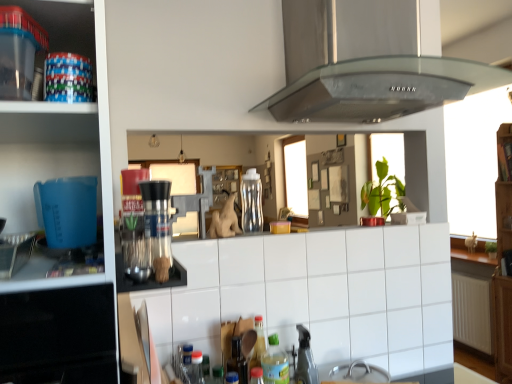
In order to face stainless steel range hood at upper center, should I rotate leftwards or rightwards?

To align with it, rotate right about 15.966°.

Describe the element at coordinates (362, 76) in the screenshot. I see `stainless steel range hood at upper center` at that location.

Describe the element at coordinates (305, 359) in the screenshot. I see `metallic silver faucet at lower center` at that location.

Find the location of a particular element. satin silver coffee machine at center is located at coordinates (157, 225).

Describe the element at coordinates (317, 294) in the screenshot. I see `white tile at center` at that location.

This screenshot has height=384, width=512. I want to click on translucent plastic bottle at lower center, acting as the second bottle starting from the top, so click(275, 363).

Is metallic silver faucet at lower center placed right next to transparent plastic containers at upper left?

No.

From a real-world perspective, is metallic silver faucet at lower center on top of transparent plastic containers at upper left?

Actually, metallic silver faucet at lower center is physically below transparent plastic containers at upper left in the real world.

You are a GUI agent. You are given a task and a screenshot of the screen. Output one action in this format:
    pyautogui.click(x=<x>, y=<y>)
    Task: Click on the cabinetry above the metallic silver faucet at lower center (from the image's perspective)
    The height and width of the screenshot is (384, 512).
    Given the screenshot: What is the action you would take?
    (65, 25)

Is metallic silver faucet at lower center not within transparent plastic containers at upper left?

metallic silver faucet at lower center lies outside transparent plastic containers at upper left's area.

Do you think white tile at center is within translucent plastic bottle at lower center, placed as the first bottle when sorted from bottom to top, or outside of it?

white tile at center is located beyond the bounds of translucent plastic bottle at lower center, placed as the first bottle when sorted from bottom to top.

Considering the relative positions of white tile at center and translucent plastic bottle at lower center, which is the 1th bottle from front to back, in the image provided, is white tile at center to the left of translucent plastic bottle at lower center, which is the 1th bottle from front to back, from the viewer's perspective?

No.

Based on their sizes in the image, would you say transparent plastic containers at upper left is bigger or smaller than wooden shelf at upper right?

Considering their sizes, transparent plastic containers at upper left takes up more space than wooden shelf at upper right.

How many degrees apart are the facing directions of transparent plastic containers at upper left and wooden shelf at upper right?

90.4 degrees separate the facing orientations of transparent plastic containers at upper left and wooden shelf at upper right.

From the image's perspective, is transparent plastic containers at upper left located above or below wooden shelf at upper right?

transparent plastic containers at upper left is situated lower than wooden shelf at upper right in the image.

Which object is positioned more to the left, transparent plastic containers at upper left or wooden shelf at upper right?

transparent plastic containers at upper left is more to the left.

Which object is positioned more to the right, satin silver coffee machine at center or wooden shelf at upper right?

From the viewer's perspective, wooden shelf at upper right appears more on the right side.

Considering the positions of objects satin silver coffee machine at center and wooden shelf at upper right in the image provided, who is behind, satin silver coffee machine at center or wooden shelf at upper right?

wooden shelf at upper right is more distant.

From a real-world perspective, between satin silver coffee machine at center and wooden shelf at upper right, who is vertically higher?

wooden shelf at upper right is physically above.

Consider the image. Does wooden shelf at upper right appear on the right side of white tile at center?

Yes, wooden shelf at upper right is to the right of white tile at center.

In the scene shown: From the image's perspective, is wooden shelf at upper right above or below white tile at center?

From the image's perspective, wooden shelf at upper right appears above white tile at center.

Is wooden shelf at upper right closer to camera compared to white tile at center?

No, wooden shelf at upper right is further to the viewer.

Is wooden shelf at upper right oriented towards white tile at center?

No, wooden shelf at upper right does not turn towards white tile at center.

Which is more to the left, stainless steel range hood at upper center or translucent plastic bottle at lower center, the 2th bottle positioned from the back?

Positioned to the left is translucent plastic bottle at lower center, the 2th bottle positioned from the back.

Is point (306, 121) behind point (269, 342)?

Yes, point (306, 121) is behind point (269, 342).

From a real-world perspective, between stainless steel range hood at upper center and translucent plastic bottle at lower center, acting as the second bottle starting from the top, who is vertically lower?

translucent plastic bottle at lower center, acting as the second bottle starting from the top, from a real-world perspective.

From the image's perspective, which is above, stainless steel range hood at upper center or translucent plastic bottle at lower center, placed as the first bottle when sorted from bottom to top?

stainless steel range hood at upper center.

Is the position of transparent plastic bottle at center, which is counted as the 1th bottle, starting from the back, more distant than that of stainless steel range hood at upper center?

Yes, it is.

How different are the orientations of transparent plastic bottle at center, which is counted as the 1th bottle, starting from the back, and stainless steel range hood at upper center in degrees?

The angular difference between transparent plastic bottle at center, which is counted as the 1th bottle, starting from the back, and stainless steel range hood at upper center is 1.02 degrees.

Is transparent plastic bottle at center, which is counted as the 1th bottle, starting from the back, placed right next to stainless steel range hood at upper center?

transparent plastic bottle at center, which is counted as the 1th bottle, starting from the back, and stainless steel range hood at upper center are not in contact.

Is point (259, 197) in front of point (368, 74)?

That is False.

Identify the location of cabinetry that appears on the left of metallic silver faucet at lower center. [65, 25].

I want to click on counter top above the translucent plastic bottle at lower center, acting as the second bottle starting from the top (from a real-world perspective), so click(x=317, y=294).

Considering their positions, is transparent plastic containers at upper left positioned closer to transparent plastic bottle at center, marked as the 1th bottle in a top-to-bottom arrangement, than wooden shelf at upper right?

Among the two, transparent plastic containers at upper left is located nearer to transparent plastic bottle at center, marked as the 1th bottle in a top-to-bottom arrangement.

Looking at the image, which one is located closer to white tile at center, transparent plastic containers at upper left or satin silver coffee machine at center?

satin silver coffee machine at center is closer to white tile at center.

Which object lies nearer to the anchor point translucent plastic bottle at lower center, placed as the first bottle when sorted from bottom to top, satin silver coffee machine at center or wooden shelf at upper right?

satin silver coffee machine at center is positioned closer to the anchor translucent plastic bottle at lower center, placed as the first bottle when sorted from bottom to top.

Considering their positions, is white tile at center positioned further to wooden shelf at upper right than transparent plastic containers at upper left?

transparent plastic containers at upper left lies further to wooden shelf at upper right than the other object.

When comparing their distances from transparent plastic bottle at center, which is the second bottle from bottom to top, does white tile at center or translucent plastic bottle at lower center, placed as the first bottle when sorted from bottom to top, seem closer?

Among the two, white tile at center is located nearer to transparent plastic bottle at center, which is the second bottle from bottom to top.

Considering their positions, is satin silver coffee machine at center positioned further to stainless steel range hood at upper center than wooden shelf at upper right?

The object further to stainless steel range hood at upper center is wooden shelf at upper right.

Estimate the real-world distances between objects in this image. Which object is closer to white tile at center, stainless steel range hood at upper center or wooden shelf at upper right?

stainless steel range hood at upper center is closer to white tile at center.

Looking at the image, which one is located further to translucent plastic bottle at lower center, placed as the first bottle when sorted from bottom to top, stainless steel range hood at upper center or wooden shelf at upper right?

wooden shelf at upper right.

Where is `cabinetry between stainless steel range hood at upper center and metallic silver faucet at lower center in the vertical direction`? cabinetry between stainless steel range hood at upper center and metallic silver faucet at lower center in the vertical direction is located at coordinates (65, 25).

You are a GUI agent. You are given a task and a screenshot of the screen. Output one action in this format:
    pyautogui.click(x=<x>, y=<y>)
    Task: Click on the counter top between transparent plastic bottle at center, marked as the second bottle in a front-to-back arrangement, and translucent plastic bottle at lower center, acting as the second bottle starting from the top, from top to bottom
    
    Given the screenshot: What is the action you would take?
    pyautogui.click(x=317, y=294)

Where is `appliance between transparent plastic containers at upper left and translucent plastic bottle at lower center, acting as the second bottle starting from the top, in the vertical direction`? This screenshot has height=384, width=512. appliance between transparent plastic containers at upper left and translucent plastic bottle at lower center, acting as the second bottle starting from the top, in the vertical direction is located at coordinates (305, 359).

I want to click on bottle between transparent plastic bottle at center, marked as the second bottle in a front-to-back arrangement, and wooden shelf at upper right, so click(275, 363).